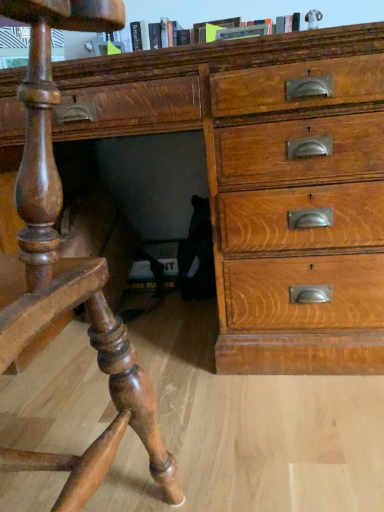
This screenshot has height=512, width=384. What do you see at coordinates (270, 182) in the screenshot?
I see `wooden chest of drawers at center` at bounding box center [270, 182].

Describe the element at coordinates (71, 270) in the screenshot. I see `shiny polished wood desk at lower left` at that location.

I want to click on wooden chest of drawers at center, so click(x=270, y=182).

Does wooden chest of drawers at center have a lesser width compared to shiny polished wood desk at lower left?

Incorrect, the width of wooden chest of drawers at center is not less than that of shiny polished wood desk at lower left.

Is wooden chest of drawers at center situated inside shiny polished wood desk at lower left or outside?

wooden chest of drawers at center is not enclosed by shiny polished wood desk at lower left.

Which point is more forward, (240, 214) or (76, 28)?

The point (76, 28) is closer.

Are shiny polished wood desk at lower left and wooden chest of drawers at center far apart?

No.

From a real-world perspective, is shiny polished wood desk at lower left under wooden chest of drawers at center?

Correct, in the physical world, shiny polished wood desk at lower left is lower than wooden chest of drawers at center.

What are the coordinates of `chest of drawers to the right of shiny polished wood desk at lower left` in the screenshot? It's located at (270, 182).

Is wooden chest of drawers at center at the back of shiny polished wood desk at lower left?

No, shiny polished wood desk at lower left is not facing away from wooden chest of drawers at center.

Is hardcover book at upper center smaller than wooden chest of drawers at center?

Indeed, hardcover book at upper center has a smaller size compared to wooden chest of drawers at center.

Considering the relative sizes of hardcover book at upper center and wooden chest of drawers at center in the image provided, is hardcover book at upper center wider than wooden chest of drawers at center?

No, hardcover book at upper center is not wider than wooden chest of drawers at center.

Is hardcover book at upper center situated inside wooden chest of drawers at center or outside?

hardcover book at upper center cannot be found inside wooden chest of drawers at center.

In the scene shown: Measure the distance between hardcover book at upper center and wooden chest of drawers at center.

The distance of hardcover book at upper center from wooden chest of drawers at center is 25.18 inches.

Consider the image. Is shiny polished wood desk at lower left spatially inside hardcover book at upper center, or outside of it?

shiny polished wood desk at lower left exists outside the volume of hardcover book at upper center.

Does shiny polished wood desk at lower left lie behind hardcover book at upper center?

No, it is in front of hardcover book at upper center.

Based on the photo, which is more to the left, shiny polished wood desk at lower left or hardcover book at upper center?

Positioned to the left is shiny polished wood desk at lower left.

Is point (18, 196) closer or farther from the camera than point (235, 23)?

Clearly, point (18, 196) is closer to the camera than point (235, 23).

Can you confirm if hardcover book at upper center is positioned to the left of shiny polished wood desk at lower left?

Incorrect, hardcover book at upper center is not on the left side of shiny polished wood desk at lower left.

Is shiny polished wood desk at lower left at the back of hardcover book at upper center?

That's not correct — hardcover book at upper center is not looking away from shiny polished wood desk at lower left.

Which of these two, hardcover book at upper center or shiny polished wood desk at lower left, is smaller?

hardcover book at upper center is smaller.

Is hardcover book at upper center beside shiny polished wood desk at lower left?

No, hardcover book at upper center is not with shiny polished wood desk at lower left.

From a real-world perspective, between wooden chest of drawers at center and hardcover book at upper center, who is vertically lower?

From a 3D spatial view, wooden chest of drawers at center is below.

From the image's perspective, is wooden chest of drawers at center positioned above or below hardcover book at upper center?

Clearly, from the image's perspective, wooden chest of drawers at center is below hardcover book at upper center.

Is wooden chest of drawers at center surrounding hardcover book at upper center?

No, hardcover book at upper center is not surrounded by wooden chest of drawers at center.

Considering the sizes of objects wooden chest of drawers at center and hardcover book at upper center in the image provided, who is bigger, wooden chest of drawers at center or hardcover book at upper center?

wooden chest of drawers at center is bigger.

Find the location of `the chest of drawers above the shiny polished wood desk at lower left (from the image's perspective)`. the chest of drawers above the shiny polished wood desk at lower left (from the image's perspective) is located at coordinates (270, 182).

Where is `chest of drawers located on the right of shiny polished wood desk at lower left`? This screenshot has width=384, height=512. chest of drawers located on the right of shiny polished wood desk at lower left is located at coordinates (270, 182).

Looking at the image, which one is located closer to hardcover book at upper center, wooden chest of drawers at center or shiny polished wood desk at lower left?

Among the two, wooden chest of drawers at center is located nearer to hardcover book at upper center.

From the image, which object appears to be nearer to wooden chest of drawers at center, shiny polished wood desk at lower left or hardcover book at upper center?

shiny polished wood desk at lower left is positioned closer to the anchor wooden chest of drawers at center.

When comparing their distances from wooden chest of drawers at center, does hardcover book at upper center or shiny polished wood desk at lower left seem further?

hardcover book at upper center lies further to wooden chest of drawers at center than the other object.

Looking at the image, which one is located closer to hardcover book at upper center, shiny polished wood desk at lower left or wooden chest of drawers at center?

The object closer to hardcover book at upper center is wooden chest of drawers at center.

From the image, which object appears to be farther from shiny polished wood desk at lower left, hardcover book at upper center or wooden chest of drawers at center?

hardcover book at upper center is positioned further to the anchor shiny polished wood desk at lower left.

Based on their spatial positions, is wooden chest of drawers at center or hardcover book at upper center further from shiny polished wood desk at lower left?

Among the two, hardcover book at upper center is located further to shiny polished wood desk at lower left.

You are a GUI agent. You are given a task and a screenshot of the screen. Output one action in this format:
    pyautogui.click(x=<x>, y=<y>)
    Task: Click on the chest of drawers between shiny polished wood desk at lower left and hardcover book at upper center from front to back
    The width and height of the screenshot is (384, 512).
    Given the screenshot: What is the action you would take?
    pyautogui.click(x=270, y=182)